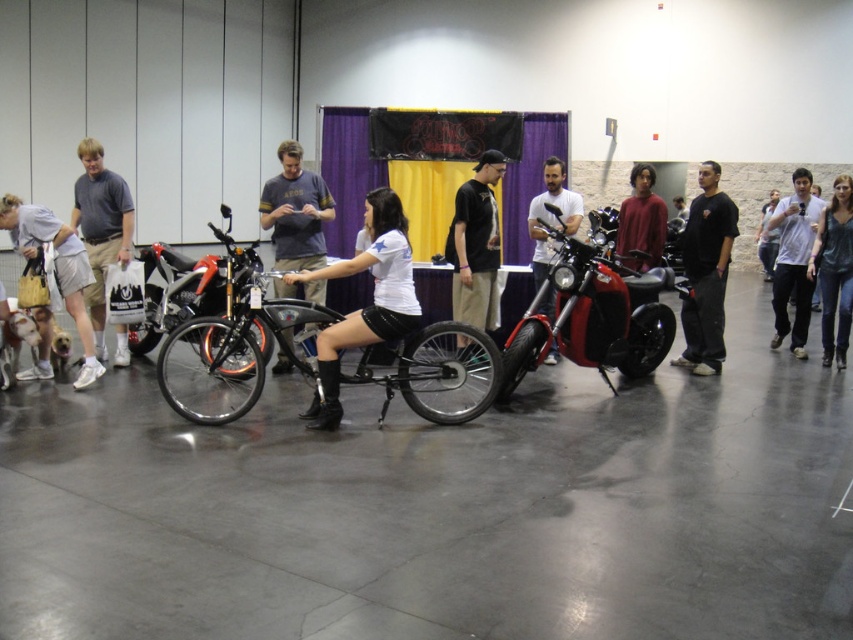
Is matte black shorts at center bigger than white cotton shirt at left?

Actually, matte black shorts at center might be smaller than white cotton shirt at left.

Who is more distant from viewer, (311, 278) or (65, 305)?

The point (65, 305) is behind.

This screenshot has width=853, height=640. Find the location of `matte black shorts at center`. matte black shorts at center is located at coordinates (368, 305).

Does white cotton shirt at left have a larger size compared to matte red sweater at center?

Yes, white cotton shirt at left is bigger than matte red sweater at center.

Can you confirm if white cotton shirt at left is shorter than matte red sweater at center?

Incorrect, white cotton shirt at left's height does not fall short of matte red sweater at center's.

Between point (1, 211) and point (624, 250), which one is positioned behind?

The point (624, 250) is more distant.

I want to click on white cotton shirt at left, so click(x=56, y=268).

Is white cotton shirt at center in front of denim jeans at center?

No, it is behind denim jeans at center.

Can you confirm if white cotton shirt at center is bigger than denim jeans at center?

Yes, white cotton shirt at center is bigger than denim jeans at center.

This screenshot has width=853, height=640. Identify the location of white cotton shirt at center. (793, 260).